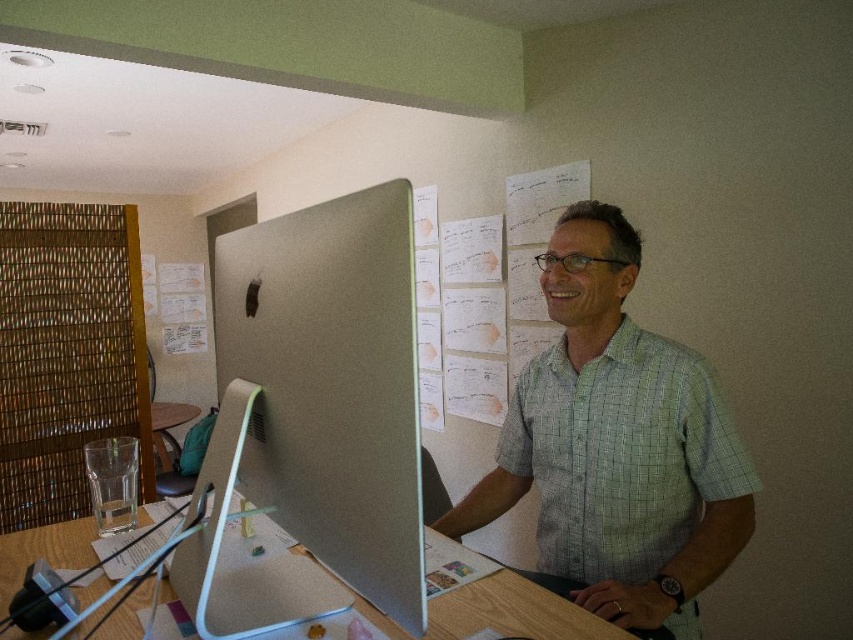
Does sleek silver monitor at center appear over brown wooden table at center?

Correct, sleek silver monitor at center is located above brown wooden table at center.

Which is in front, point (212, 544) or point (160, 429)?

Point (212, 544)

Between point (224, 637) and point (190, 412), which one is positioned in front?

Point (224, 637)

Locate an element on the screen. The height and width of the screenshot is (640, 853). sleek silver monitor at center is located at coordinates (212, 508).

Measure the distance between woven bamboo at left and sleek silver monitor at center.

woven bamboo at left is 4.21 feet away from sleek silver monitor at center.

Which is behind, point (61, 474) or point (270, 509)?

Point (61, 474)

In order to click on woven bamboo at left in this screenshot , I will do `click(67, 355)`.

Is green checkered shirt at center bigger than brown wooden table at center?

No.

This screenshot has width=853, height=640. Describe the element at coordinates (616, 444) in the screenshot. I see `green checkered shirt at center` at that location.

The width and height of the screenshot is (853, 640). I want to click on green checkered shirt at center, so click(616, 444).